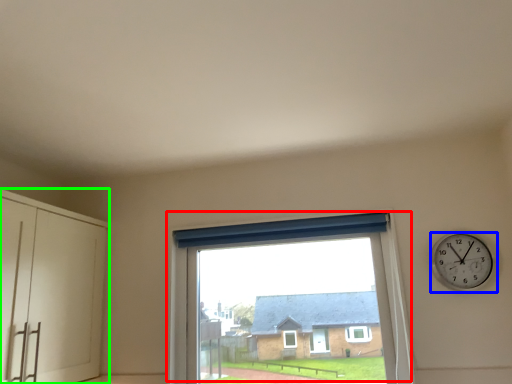
Question: Based on their relative distances, which object is farther from window (highlighted by a red box)? Choose from wall clock (highlighted by a blue box) and dresser (highlighted by a green box).

Choices:
 (A) wall clock
 (B) dresser

Answer: (B)